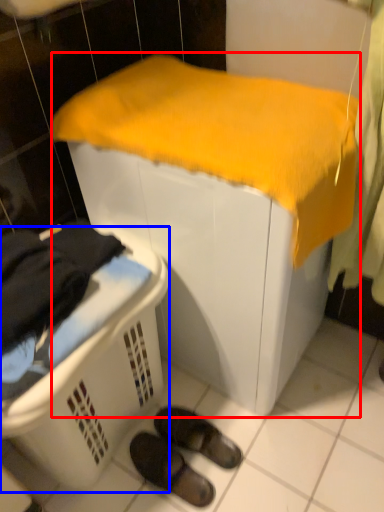
Question: Among these objects, which one is nearest to the camera, furniture (highlighted by a red box) or laundry basket (highlighted by a blue box)?

Choices:
 (A) furniture
 (B) laundry basket

Answer: (B)